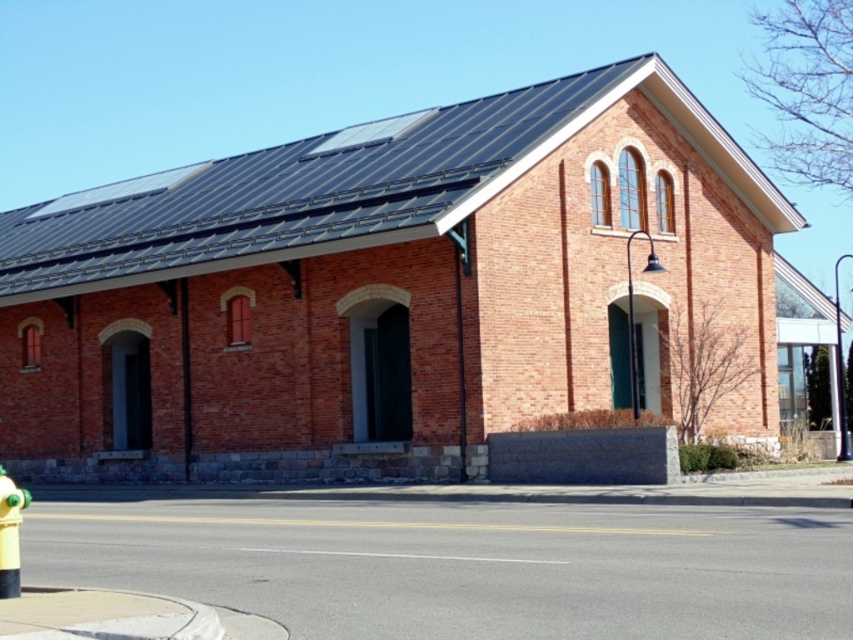
Question: Which object is farther from the camera taking this photo?

Choices:
 (A) black metal pole at center
 (B) brick building at center

Answer: (A)

Question: Which object is the closest to the black metal pole at center?

Choices:
 (A) yellow matte fire hydrant at lower left
 (B) brick building at center

Answer: (B)

Question: Is brick building at center closer to the viewer compared to yellow matte fire hydrant at lower left?

Choices:
 (A) no
 (B) yes

Answer: (A)

Question: Considering the relative positions of brick building at center and yellow matte fire hydrant at lower left in the image provided, where is brick building at center located with respect to yellow matte fire hydrant at lower left?

Choices:
 (A) above
 (B) below

Answer: (A)

Question: Can you confirm if yellow matte fire hydrant at lower left is wider than black metal pole at center?

Choices:
 (A) yes
 (B) no

Answer: (B)

Question: Which point is closer to the camera?

Choices:
 (A) brick building at center
 (B) black metal pole at center
 (C) yellow matte fire hydrant at lower left

Answer: (C)